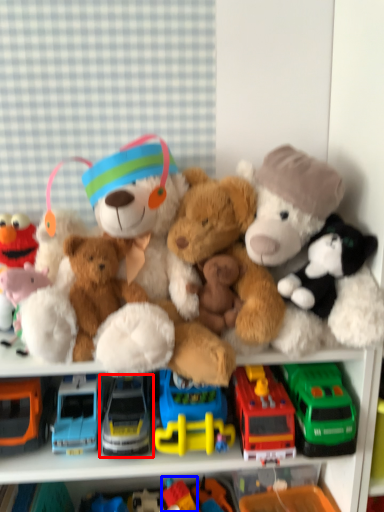
Question: Which object appears farthest to the camera in this image, truck (highlighted by a red box) or toy (highlighted by a blue box)?

Choices:
 (A) truck
 (B) toy

Answer: (B)